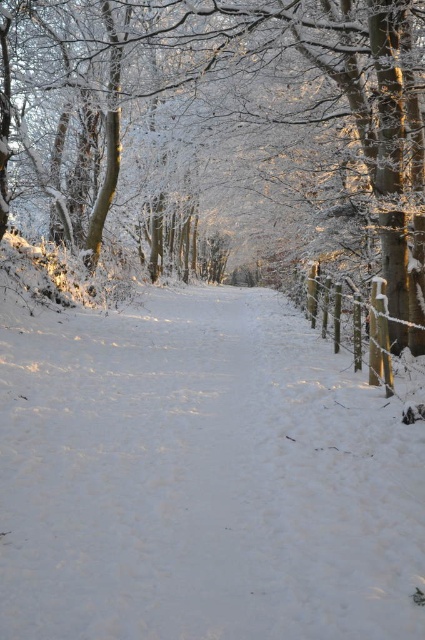
Question: Does white snow at center have a larger size compared to wooden fence at right?

Choices:
 (A) yes
 (B) no

Answer: (A)

Question: Which point is closer to the camera?

Choices:
 (A) (379, 348)
 (B) (56, 540)

Answer: (B)

Question: Which of these objects is positioned farthest from the wooden fence at right?

Choices:
 (A) white frosty tree at center
 (B) white snow at center

Answer: (A)

Question: Does white snow at center appear over wooden fence at right?

Choices:
 (A) no
 (B) yes

Answer: (A)

Question: Which of the following is the closest to the observer?

Choices:
 (A) (27, 448)
 (B) (379, 308)
 (C) (209, 92)

Answer: (A)

Question: Can you confirm if white snow at center is positioned below wooden fence at right?

Choices:
 (A) yes
 (B) no

Answer: (A)